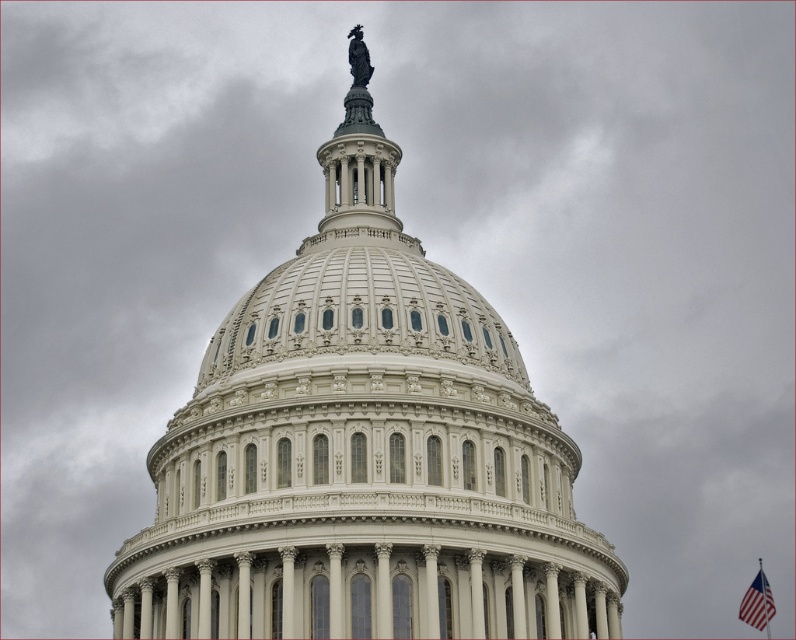
Question: Does white marble dome at center lie in front of american flag at lower right?

Choices:
 (A) no
 (B) yes

Answer: (B)

Question: Among these objects, which one is farthest from the camera?

Choices:
 (A) white marble dome at center
 (B) american flag at lower right

Answer: (B)

Question: Is white marble dome at center bigger than american flag at lower right?

Choices:
 (A) no
 (B) yes

Answer: (B)

Question: Which point is farther from the camera taking this photo?

Choices:
 (A) click(x=771, y=592)
 (B) click(x=334, y=385)

Answer: (A)

Question: Can you confirm if white marble dome at center is bigger than american flag at lower right?

Choices:
 (A) no
 (B) yes

Answer: (B)

Question: Which of the following is the farthest from the observer?

Choices:
 (A) (521, 509)
 (B) (750, 602)

Answer: (B)